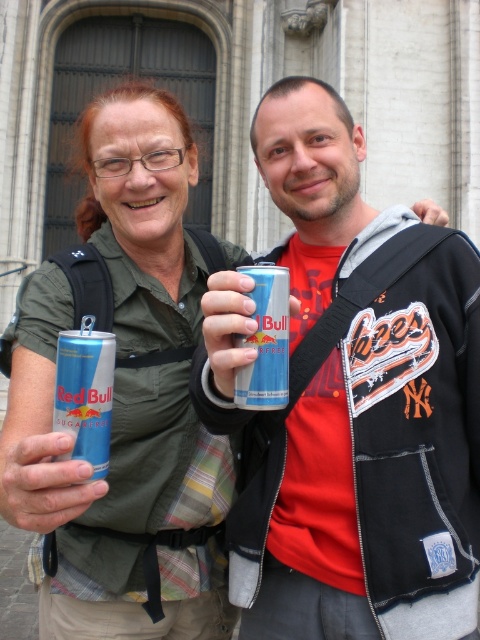
Consider the image. Can you confirm if metallic can at center is positioned below blue metallic can at center?

Correct, metallic can at center is located below blue metallic can at center.

Is point (372, 609) less distant than point (263, 314)?

Yes, point (372, 609) is in front of point (263, 314).

Identify the location of metallic can at center. (349, 403).

Can you confirm if matte black sweatshirt at left is smaller than metallic blue can at lower left?

No.

Does point (155, 349) come farther from viewer compared to point (84, 508)?

That is True.

Find the location of a particular element. The image size is (480, 640). matte black sweatshirt at left is located at coordinates pyautogui.click(x=147, y=433).

Looking at this image, is metallic blue can at lower left thinner than blue metallic can at center?

Incorrect, metallic blue can at lower left's width is not less than blue metallic can at center's.

Is metallic blue can at lower left in front of blue metallic can at center?

That is True.

Which is behind, point (25, 518) or point (259, 332)?

Point (259, 332)

Where is `metallic blue can at lower left`? metallic blue can at lower left is located at coordinates (41, 476).